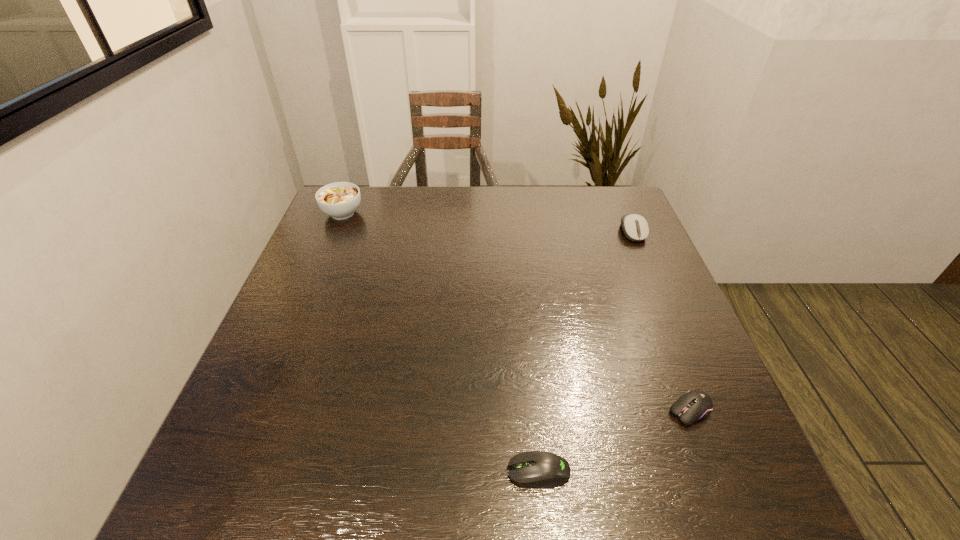
Identify the location of free spot between the second tallest object and the nearest object. (586, 352).

Find the location of a particular element. This screenshot has width=960, height=540. unoccupied area between the nearest object and the tallest computer mouse is located at coordinates (586, 352).

Locate an element on the screen. unoccupied position between the second farthest computer mouse and the farthest computer mouse is located at coordinates (661, 321).

Locate an element on the screen. This screenshot has height=540, width=960. vacant space in between the tallest computer mouse and the nearest object is located at coordinates (586, 352).

At what (x,y) coordinates should I click in order to perform the action: click on vacant space that is in between the soup bowl and the third shortest object. Please return your answer as a coordinate pair (x, y). Image resolution: width=960 pixels, height=540 pixels. Looking at the image, I should click on (488, 222).

This screenshot has width=960, height=540. In order to click on object that is the second closest to the nearest computer mouse in this screenshot , I will do `click(635, 227)`.

Where is `object that stands as the second closest to the tallest object`? object that stands as the second closest to the tallest object is located at coordinates (539, 469).

Locate which computer mouse is the closest to the second nearest object. Please provide its 2D coordinates. Your answer should be formatted as a tuple, i.e. [(x, y)], where the tuple contains the x and y coordinates of a point satisfying the conditions above.

[(539, 469)]

Point out which computer mouse is positioned as the nearest to the nearest computer mouse. Please provide its 2D coordinates. Your answer should be formatted as a tuple, i.e. [(x, y)], where the tuple contains the x and y coordinates of a point satisfying the conditions above.

[(695, 405)]

Where is `free region that satisfies the following two spatial constraints: 1. on the front side of the leftmost object; 2. on the right side of the second nearest computer mouse`? This screenshot has width=960, height=540. free region that satisfies the following two spatial constraints: 1. on the front side of the leftmost object; 2. on the right side of the second nearest computer mouse is located at coordinates (261, 410).